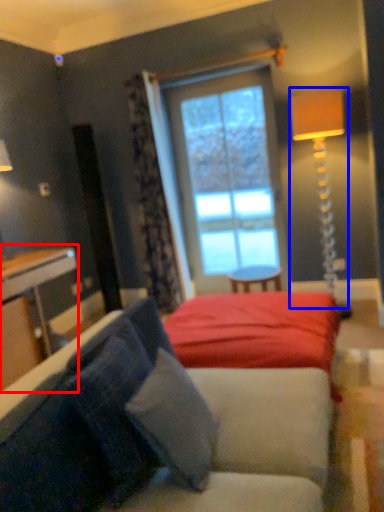
Question: Among these objects, which one is farthest to the camera, table (highlighted by a red box) or table lamp (highlighted by a blue box)?

Choices:
 (A) table
 (B) table lamp

Answer: (B)